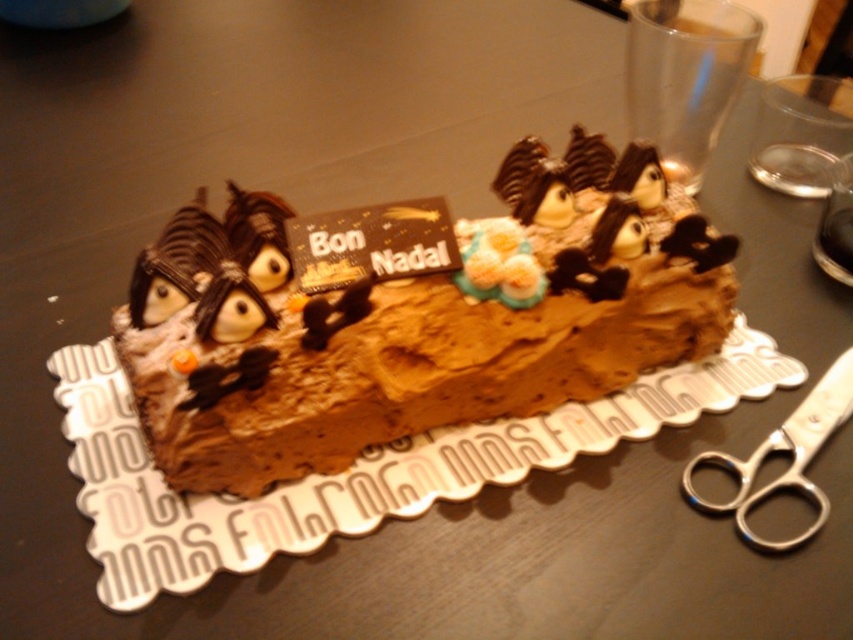
Based on the photo, which of these two, chocolate frosted cake at center or silver metallic scissors at lower right, stands taller?

With more height is chocolate frosted cake at center.

Is chocolate frosted cake at center wider than silver metallic scissors at lower right?

Indeed, chocolate frosted cake at center has a greater width compared to silver metallic scissors at lower right.

Does point (490, 244) lie behind point (788, 448)?

That is True.

Find the location of a particular element. chocolate frosted cake at center is located at coordinates (428, 323).